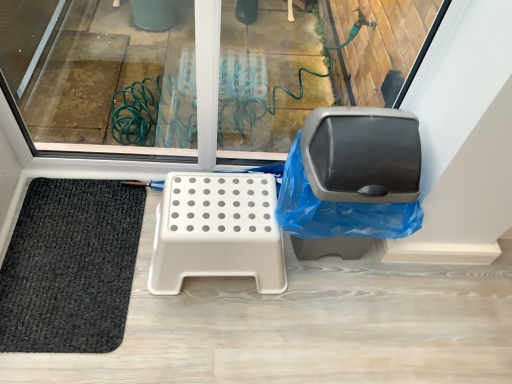
Locate an element on the screen. vacant area located to the right-hand side of black woven mat at lower left is located at coordinates (199, 320).